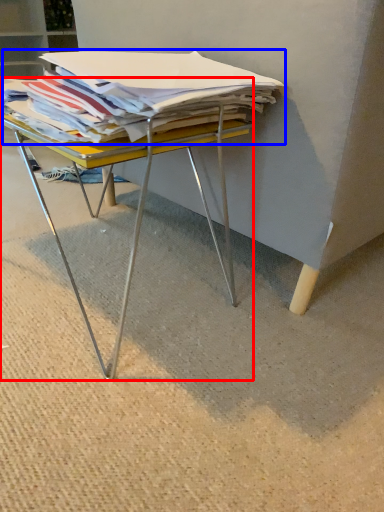
Question: Among these objects, which one is farthest to the camera, desk (highlighted by a red box) or magazine (highlighted by a blue box)?

Choices:
 (A) desk
 (B) magazine

Answer: (A)